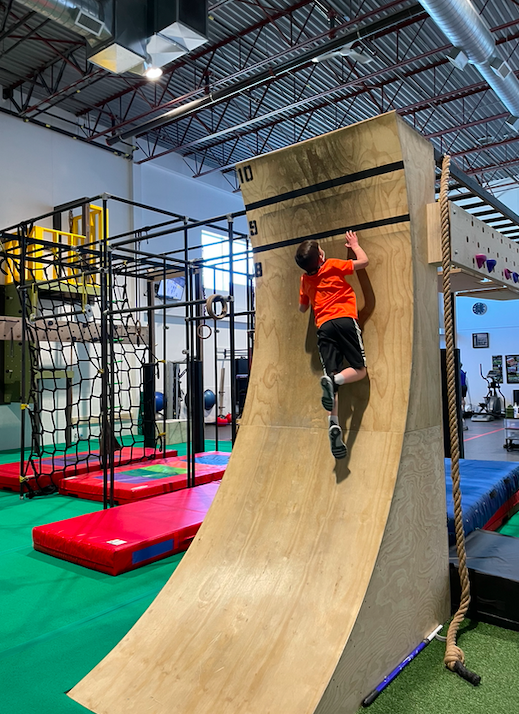
This screenshot has height=714, width=519. Find the location of `mats`. mats is located at coordinates (151, 523), (151, 476), (84, 467), (482, 493), (494, 472).